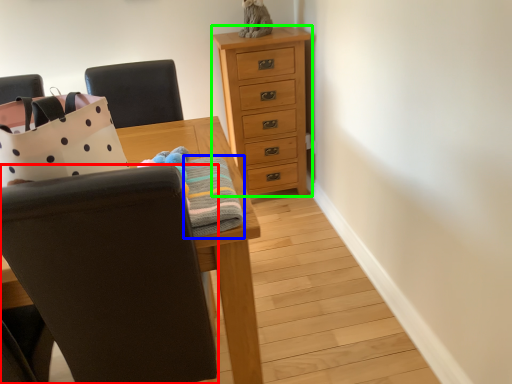
Question: Which is nearer to the chair (highlighted by a red box)? blanket (highlighted by a blue box) or chest of drawers (highlighted by a green box).

Choices:
 (A) blanket
 (B) chest of drawers

Answer: (A)